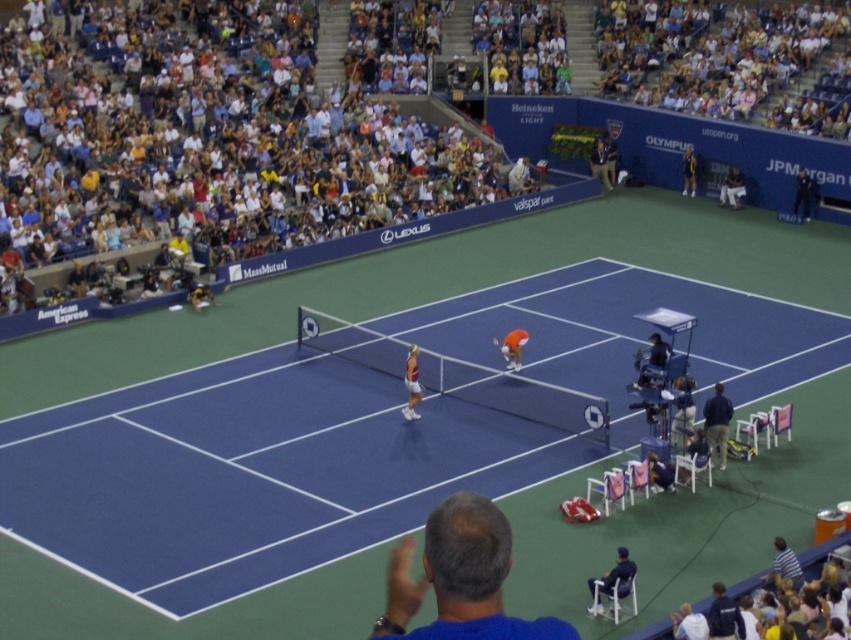
Who is higher up, blue fabric chair at lower right or orange matte tennis racket at center?

orange matte tennis racket at center is above.

Does blue fabric chair at lower right have a greater height compared to orange matte tennis racket at center?

In fact, blue fabric chair at lower right may be shorter than orange matte tennis racket at center.

The image size is (851, 640). Identify the location of blue fabric chair at lower right. (460, 579).

Locate an element on the screen. blue fabric chair at lower right is located at coordinates click(460, 579).

What do you see at coordinates (614, 580) in the screenshot? Image resolution: width=851 pixels, height=640 pixels. I see `dark blue fabric chair at lower right` at bounding box center [614, 580].

Is point (617, 552) behind point (204, 301)?

No, (617, 552) is in front of (204, 301).

Where is `dark blue fabric chair at lower right`? This screenshot has width=851, height=640. dark blue fabric chair at lower right is located at coordinates (614, 580).

Locate an element on the screen. The width and height of the screenshot is (851, 640). dark blue fabric chair at lower right is located at coordinates (614, 580).

Who is more forward, (415, 365) or (494, 337)?

Point (415, 365) is more forward.

Can you confirm if orange fabric tennis racket at center is positioned to the right of orange matte tennis racket at center?

Incorrect, orange fabric tennis racket at center is not on the right side of orange matte tennis racket at center.

Is point (404, 380) behind point (511, 352)?

No, it is not.

Identify the location of orange fabric tennis racket at center. (410, 381).